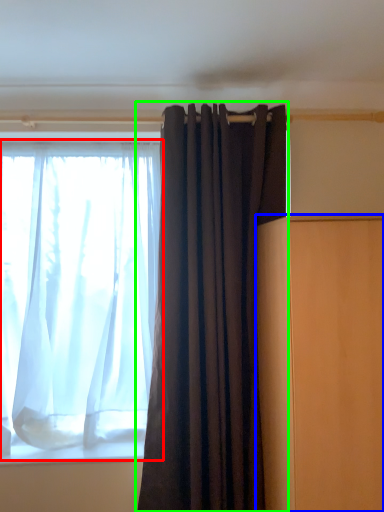
Question: Which is farther away from curtain (highlighted by a red box)? furniture (highlighted by a blue box) or curtain (highlighted by a green box)?

Choices:
 (A) furniture
 (B) curtain

Answer: (A)